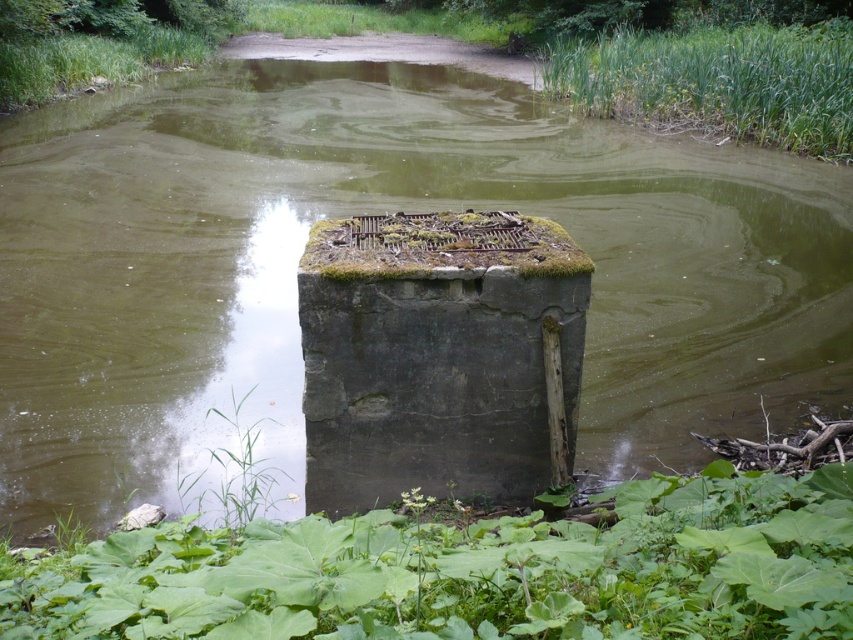
Question: Is green leafy plant at lower center positioned behind green grass at upper left?

Choices:
 (A) no
 (B) yes

Answer: (A)

Question: Which of the following is the closest to the observer?

Choices:
 (A) green grassy reeds at upper right
 (B) green grass at upper left

Answer: (A)

Question: Based on their relative distances, which object is nearer to the green leafy plant at lower center?

Choices:
 (A) dark gray concrete block at center
 (B) green grassy reeds at upper right
 (C) green grass at upper left

Answer: (A)

Question: Can you confirm if green grassy reeds at upper right is smaller than green grass at upper left?

Choices:
 (A) yes
 (B) no

Answer: (B)

Question: Is dark gray concrete block at center smaller than green grassy reeds at upper right?

Choices:
 (A) yes
 (B) no

Answer: (A)

Question: Which object is the closest to the green leafy plant at lower center?

Choices:
 (A) dark gray concrete block at center
 (B) green grass at upper left

Answer: (A)